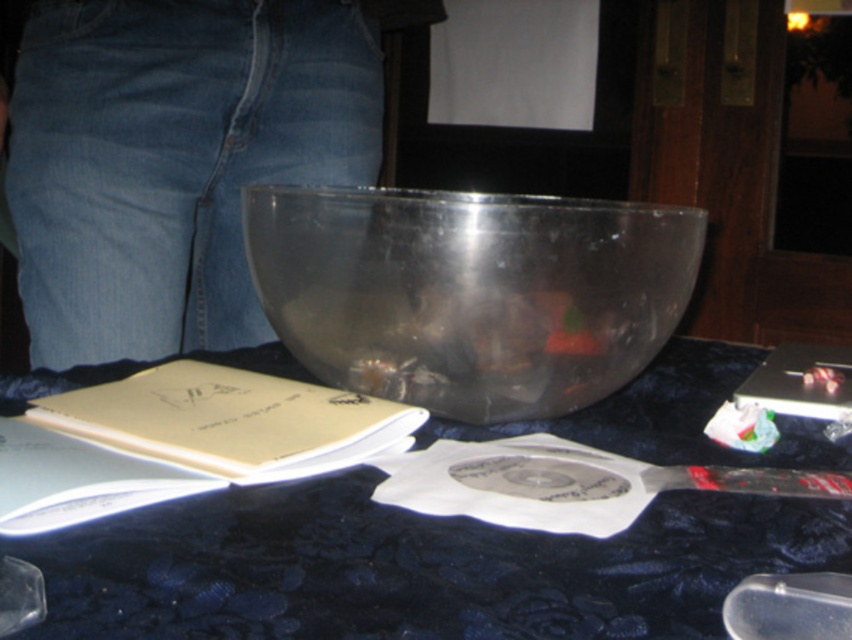
Question: Among these objects, which one is farthest from the camera?

Choices:
 (A) denim at center
 (B) transparent plastic bowl at center
 (C) transparent plastic spoon at lower right

Answer: (A)

Question: Is transparent plastic table at center thinner than transparent plastic spoon at lower right?

Choices:
 (A) yes
 (B) no

Answer: (B)

Question: From the image, what is the correct spatial relationship of transparent plastic table at center in relation to transparent plastic bowl at center?

Choices:
 (A) left
 (B) right

Answer: (A)

Question: Estimate the real-world distances between objects in this image. Which object is farther from the transparent plastic bowl at center?

Choices:
 (A) transparent plastic table at center
 (B) transparent plastic spoon at lower right

Answer: (B)

Question: Does transparent plastic table at center have a lesser width compared to denim at center?

Choices:
 (A) yes
 (B) no

Answer: (B)

Question: Which object is positioned farthest from the transparent plastic spoon at lower right?

Choices:
 (A) transparent plastic table at center
 (B) transparent plastic bowl at center
 (C) denim at center

Answer: (C)